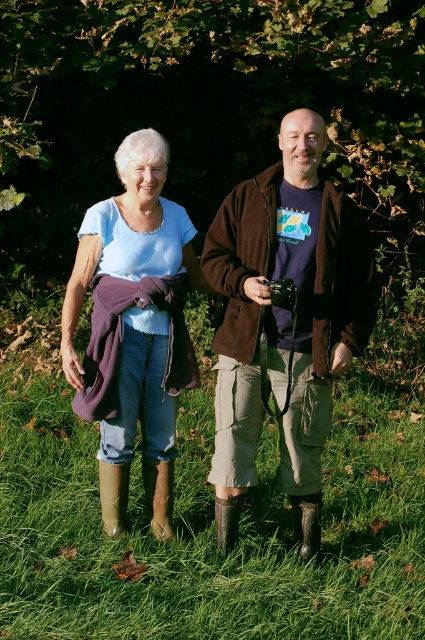
You are a photographer setting up a tripod to take a portrait of both people. The brown suede jacket at center and the matte purple scarf at left are in the frame. Which object should you adjust your focus on first to ensure both are in sharp focus?

The brown suede jacket at center is closer to the viewer than the matte purple scarf at left, so you should focus on the brown suede jacket at center first to ensure both are in sharp focus.

You are a photographer trying to capture a candid shot of the two people in the image. You want to ensure the brown suede jacket at center is in the frame. Based on its position, where should you aim your camera?

The brown suede jacket at center is located at point 2D coordinates [285,320], so aim your camera at the center of the image slightly towards the lower half to capture it.

You are a photographer setting up a tripod to take a portrait of both people in the image. You need to position the tripod so that the brown suede jacket at center and the matte purple scarf at left are both visible in the frame. Based on their positions, which object should you place closer to the bottom of the frame?

The brown suede jacket at center should be placed closer to the bottom of the frame because it is located below the matte purple scarf at left.